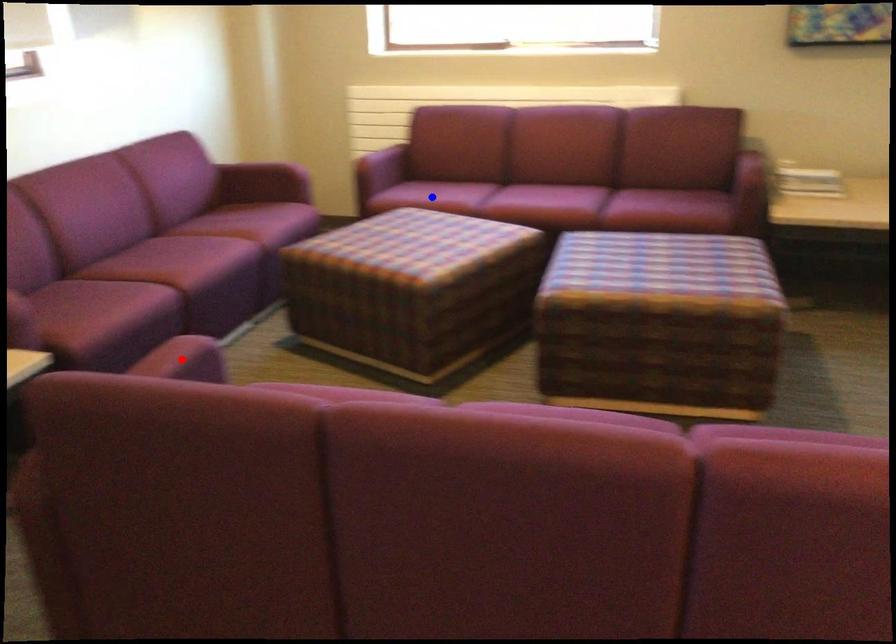
Question: Which of the two points in the image is closer to the camera?

Choices:
 (A) Blue point is closer.
 (B) Red point is closer.

Answer: (B)